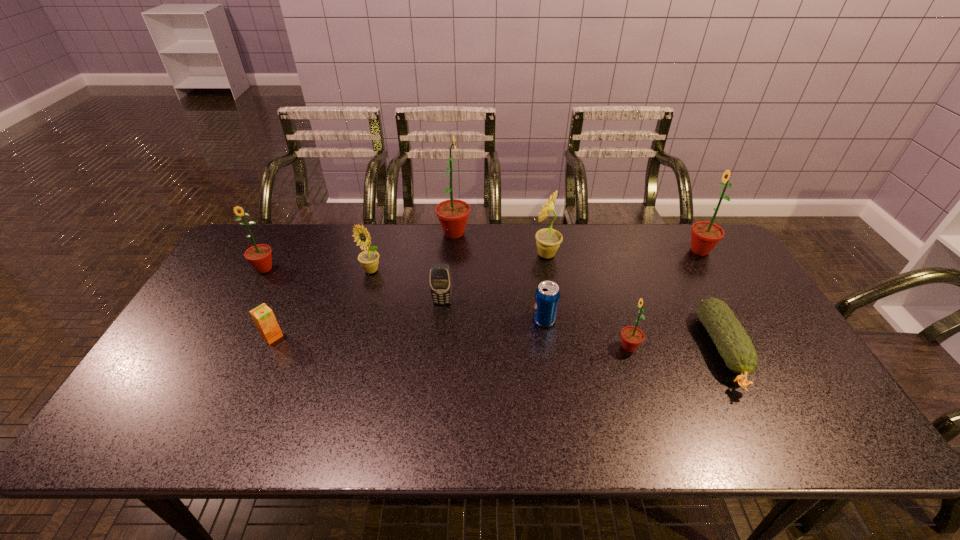
Where is `vacant space that satisfies the following two spatial constraints: 1. on the face of the leftmost green sunflower; 2. on the right side of the pop soda`? This screenshot has height=540, width=960. vacant space that satisfies the following two spatial constraints: 1. on the face of the leftmost green sunflower; 2. on the right side of the pop soda is located at coordinates (236, 320).